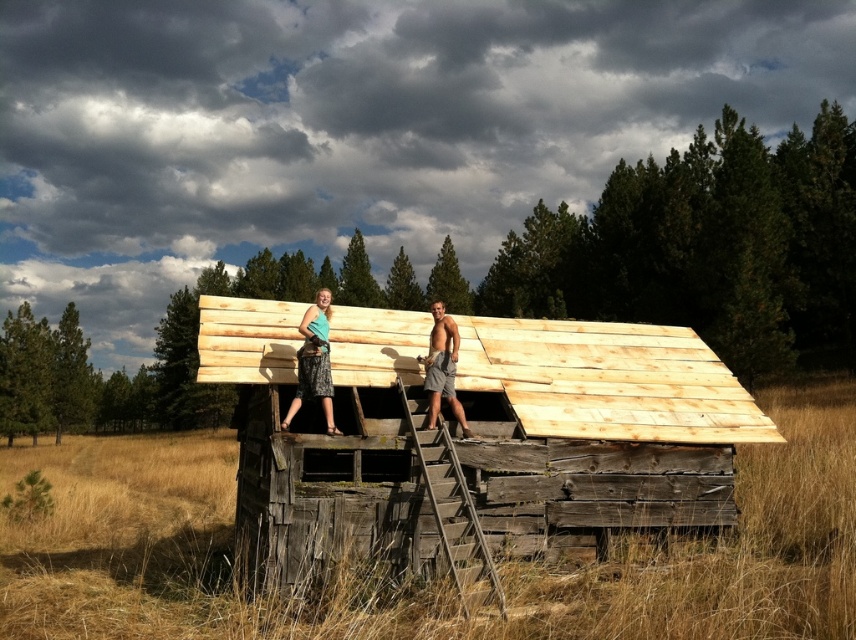
Question: Which point appears farthest from the camera in this image?

Choices:
 (A) (438, 355)
 (B) (415, 397)

Answer: (B)

Question: Which point appears closest to the camera in this image?

Choices:
 (A) (431, 500)
 (B) (504, 364)
 (C) (310, 385)
 (D) (572, 451)

Answer: (A)

Question: Which object appears farthest from the camera in this image?

Choices:
 (A) tan textured shorts at center
 (B) natural wood roof at upper center
 (C) matte teal fabric skirt at center
 (D) light brown wooden hut at center

Answer: (D)

Question: Does wooden rough-textured ladder at center come behind tan textured shorts at center?

Choices:
 (A) yes
 (B) no

Answer: (B)

Question: Can you confirm if natural wood roof at upper center is wider than tan textured shorts at center?

Choices:
 (A) no
 (B) yes

Answer: (B)

Question: Does light brown wooden hut at center have a lesser width compared to natural wood roof at upper center?

Choices:
 (A) yes
 (B) no

Answer: (A)